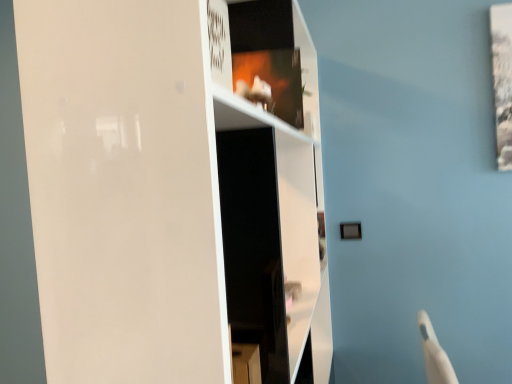
This screenshot has height=384, width=512. I want to click on white glossy cupboard at center, so click(163, 201).

What do you see at coordinates (163, 201) in the screenshot? The height and width of the screenshot is (384, 512). I see `white glossy cupboard at center` at bounding box center [163, 201].

Find the location of a particular element. white glossy cupboard at center is located at coordinates (163, 201).